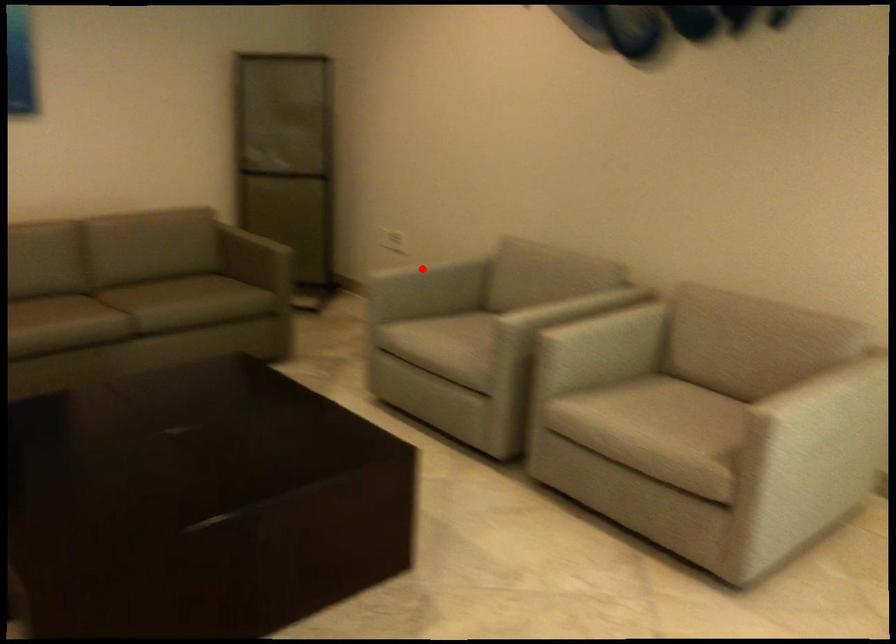
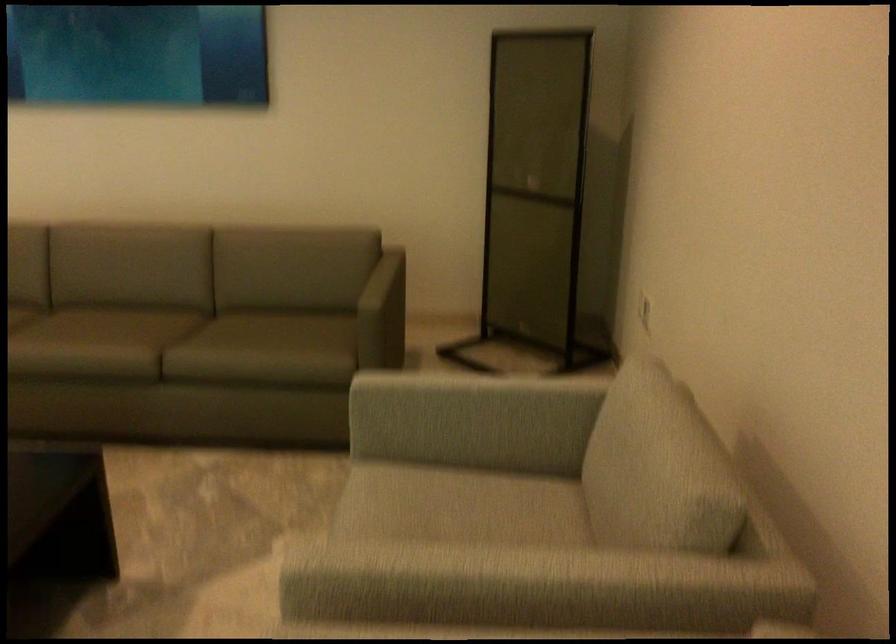
Question: I am providing you with two images of the same scene from different viewpoints. Image1 has a red point marked. In image2, the corresponding 3D location appears at what relative position? Reply with the corresponding letter.

Choices:
 (A) Closer
 (B) Farther

Answer: (A)